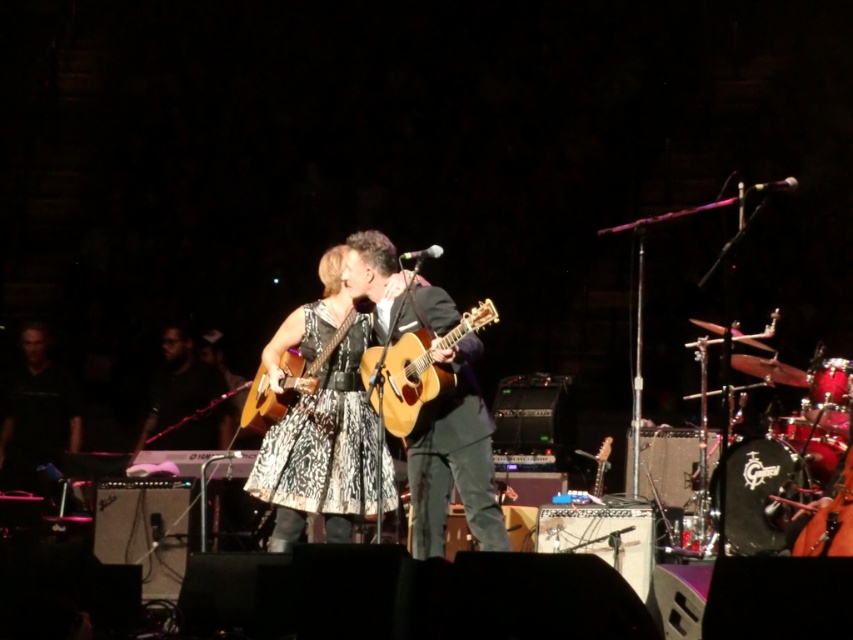
Describe the element at coordinates (36, 412) in the screenshot. I see `black matte shirt at left` at that location.

Looking at this image, is black matte shirt at left in front of acoustic wood guitar at center?

No, black matte shirt at left is behind acoustic wood guitar at center.

You are a GUI agent. You are given a task and a screenshot of the screen. Output one action in this format:
    pyautogui.click(x=<x>, y=<y>)
    Task: Click on the black matte shirt at left
    The height and width of the screenshot is (640, 853).
    Given the screenshot: What is the action you would take?
    pyautogui.click(x=36, y=412)

The width and height of the screenshot is (853, 640). What do you see at coordinates (454, 461) in the screenshot?
I see `matte brown acoustic guitar at center` at bounding box center [454, 461].

Based on the photo, does matte brown acoustic guitar at center have a greater height compared to matte black guitar at center?

Yes, matte brown acoustic guitar at center is taller than matte black guitar at center.

The width and height of the screenshot is (853, 640). I want to click on matte brown acoustic guitar at center, so click(454, 461).

Describe the element at coordinates (454, 461) in the screenshot. I see `matte brown acoustic guitar at center` at that location.

I want to click on matte brown acoustic guitar at center, so click(454, 461).